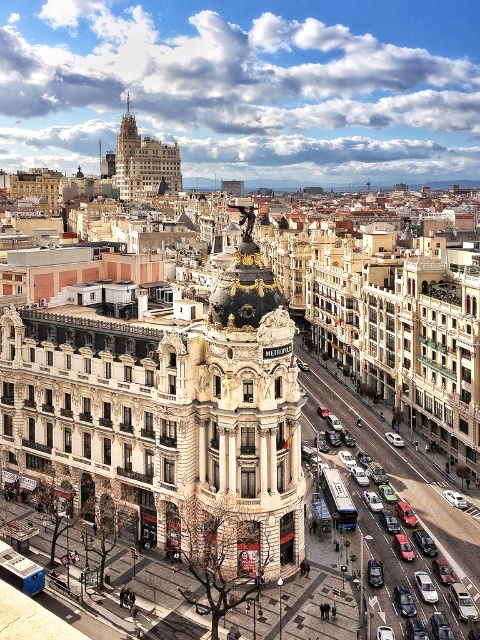
Question: Which of the following is the closest to the observer?

Choices:
 (A) gold textured tower at upper center
 (B) matte black car at center
 (C) silver metallic sedan at center

Answer: (B)

Question: From the image, what is the correct spatial relationship of beige stone tower at center in relation to silver metallic sedan at center?

Choices:
 (A) right
 (B) left

Answer: (B)

Question: Is the position of beige stone tower at center less distant than that of silver metallic sedan at center?

Choices:
 (A) yes
 (B) no

Answer: (B)

Question: Which point is farther to the camera?

Choices:
 (A) matte black car at center
 (B) silver metallic sedan at center
 (C) gold textured tower at upper center

Answer: (C)

Question: Estimate the real-world distances between objects in this image. Which object is farther from the gold textured tower at upper center?

Choices:
 (A) beige stone tower at center
 (B) matte black car at center

Answer: (A)

Question: Does beige stone tower at center have a greater width compared to gold textured tower at upper center?

Choices:
 (A) no
 (B) yes

Answer: (A)